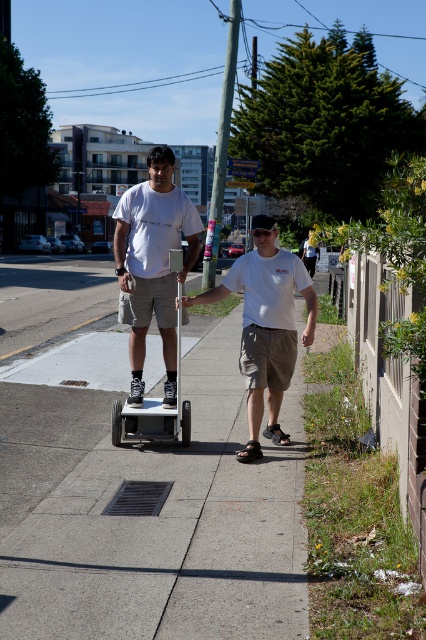
Based on the photo, is white matte shirt at center positioned before metallic silver scooter at center?

No, white matte shirt at center is further to the viewer.

Which of these two, white matte shirt at center or metallic silver scooter at center, stands taller?

Standing taller between the two is metallic silver scooter at center.

Find the location of a particular element. white matte shirt at center is located at coordinates (265, 326).

Is matte white shirt at center thinner than metallic silver scooter at center?

No, matte white shirt at center is not thinner than metallic silver scooter at center.

How far apart are matte white shirt at center and metallic silver scooter at center?

13.26 inches

This screenshot has height=640, width=426. What do you see at coordinates (152, 264) in the screenshot?
I see `matte white shirt at center` at bounding box center [152, 264].

Where is `matte white shirt at center`? matte white shirt at center is located at coordinates (152, 264).

Which of these two, matte white shirt at center or white matte shirt at center, stands shorter?

white matte shirt at center is shorter.

Can you confirm if matte white shirt at center is positioned above white matte shirt at center?

Incorrect, matte white shirt at center is not positioned above white matte shirt at center.

You are a GUI agent. You are given a task and a screenshot of the screen. Output one action in this format:
    pyautogui.click(x=<x>, y=<y>)
    Task: Click on the matte white shirt at center
    Image resolution: width=426 pixels, height=640 pixels.
    Given the screenshot: What is the action you would take?
    pyautogui.click(x=152, y=264)